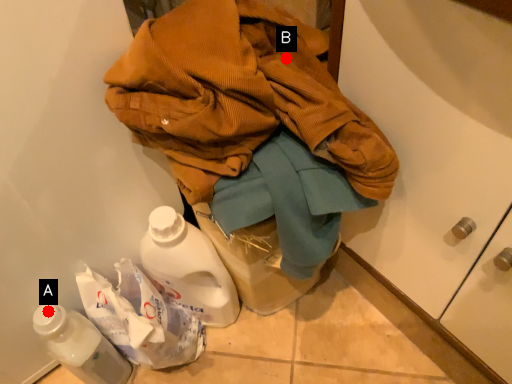
Question: Two points are circled on the image, labeled by A and B beside each circle. Among these points, which one is farthest from the camera?

Choices:
 (A) A is further
 (B) B is further

Answer: (A)